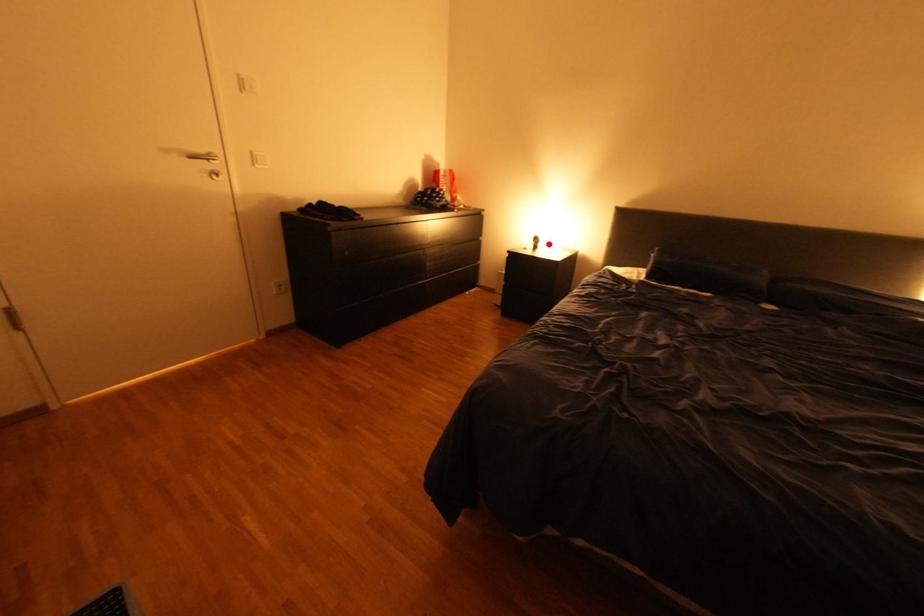
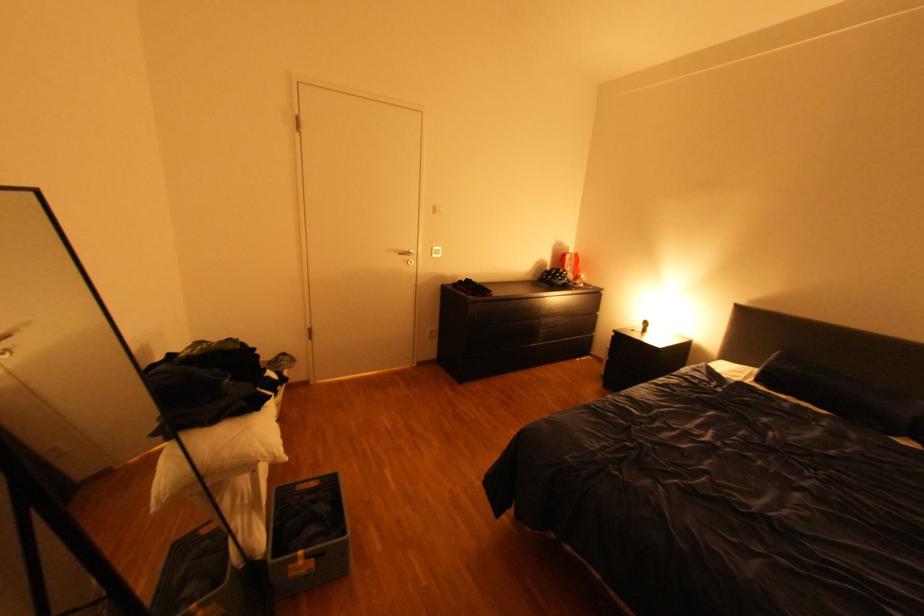
Where in the second image is the point corresponding to the highlighted location from the first image?

(659, 328)